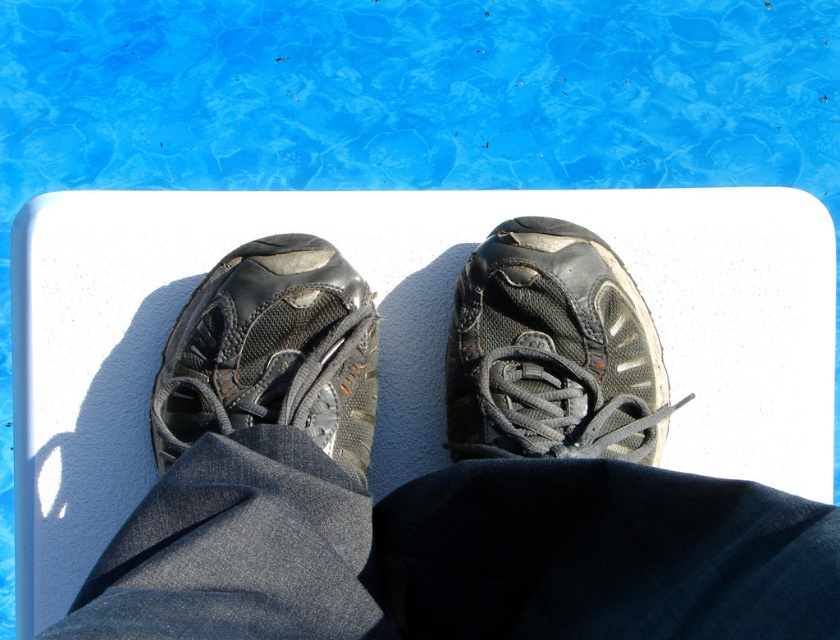
Is black mesh shoe at center behind leather/black shoe at center?

That is False.

Locate an element on the screen. black mesh shoe at center is located at coordinates (552, 349).